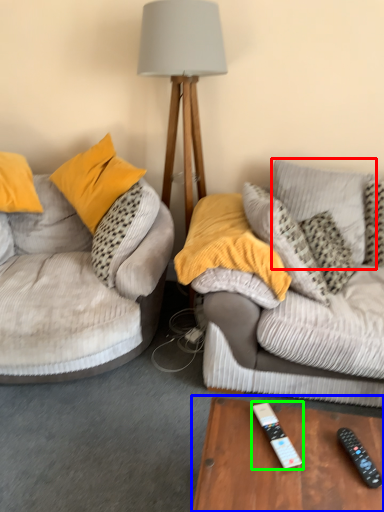
Question: Which is nearer to the pillow (highlighted by a red box)? table (highlighted by a blue box) or remote control (highlighted by a green box).

Choices:
 (A) table
 (B) remote control

Answer: (A)